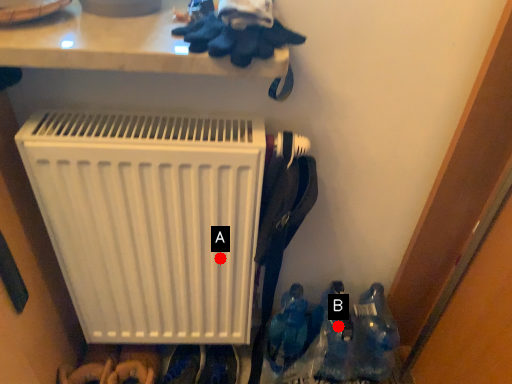
Question: Two points are circled on the image, labeled by A and B beside each circle. Which point is closer to the camera?

Choices:
 (A) A is closer
 (B) B is closer

Answer: (A)